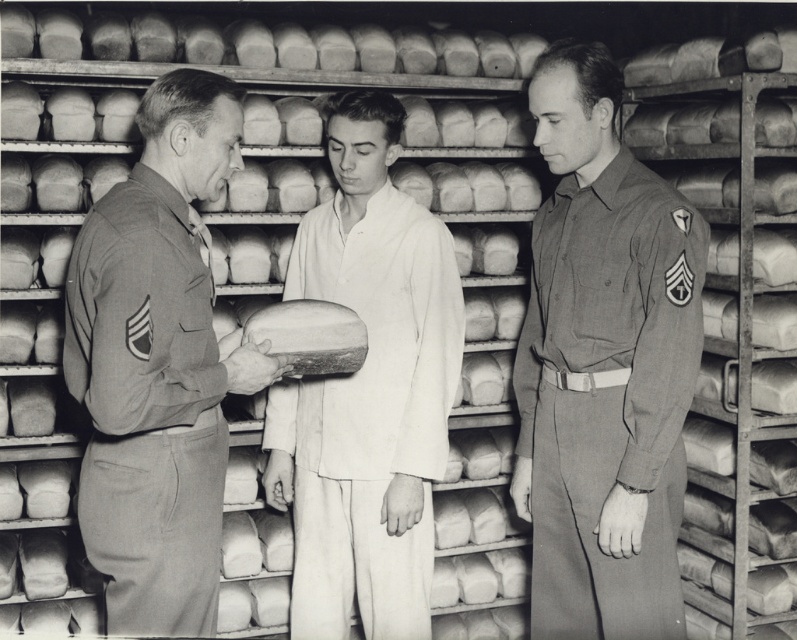
Question: Among these points, which one is nearest to the camera?

Choices:
 (A) (116, 266)
 (B) (340, 454)

Answer: (A)

Question: Can you confirm if matte khaki uniform at center is thinner than gray cotton uniform at right?

Choices:
 (A) no
 (B) yes

Answer: (A)

Question: Which point is closer to the camera?

Choices:
 (A) white cotton kimono at center
 (B) gray cotton uniform at right
 (C) matte khaki uniform at center

Answer: (C)

Question: Where is matte khaki uniform at center located in relation to white cotton kimono at center in the image?

Choices:
 (A) right
 (B) left

Answer: (B)

Question: Which point is farther from the camera taking this photo?

Choices:
 (A) (650, 616)
 (B) (222, 83)

Answer: (A)

Question: Can you confirm if gray cotton uniform at right is bigger than white cotton kimono at center?

Choices:
 (A) no
 (B) yes

Answer: (B)